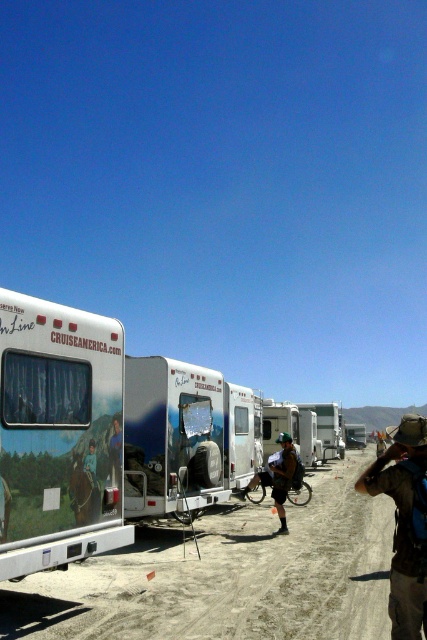
Which is more to the right, white glossy recreational vehicle at left or camouflage fabric backpack at center?

camouflage fabric backpack at center is more to the right.

Consider the image. Does white glossy recreational vehicle at left appear on the left side of camouflage fabric backpack at center?

Correct, you'll find white glossy recreational vehicle at left to the left of camouflage fabric backpack at center.

Which is in front, point (116, 484) or point (292, 465)?

Point (116, 484)

What are the coordinates of `white glossy recreational vehicle at left` in the screenshot? It's located at tap(58, 435).

Does brown fabric hat at lower right appear over white plastic camper at center?

Correct, brown fabric hat at lower right is located above white plastic camper at center.

Does brown fabric hat at lower right have a smaller size compared to white plastic camper at center?

Yes.

Is point (397, 497) farther from camera compared to point (341, 444)?

No, it is in front of (341, 444).

In order to click on brown fabric hat at lower right in this screenshot , I will do `click(404, 522)`.

Is point (338, 502) positioned after point (289, 465)?

Yes.

Describe the element at coordinates (228, 576) in the screenshot. I see `dirt track at center` at that location.

Identify the location of dirt track at center. This screenshot has height=640, width=427. (x=228, y=576).

Identify the location of dirt track at center. The image size is (427, 640). (228, 576).